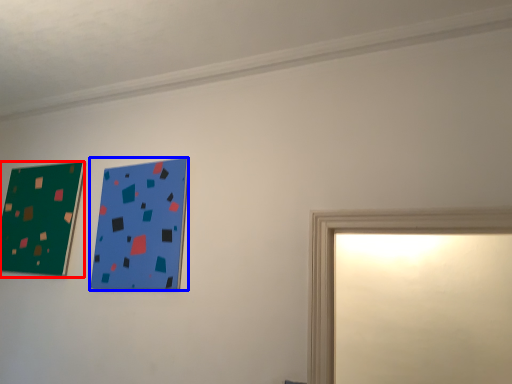
Question: Which object is closer to the camera taking this photo, picture frame (highlighted by a red box) or picture frame (highlighted by a blue box)?

Choices:
 (A) picture frame
 (B) picture frame

Answer: (B)